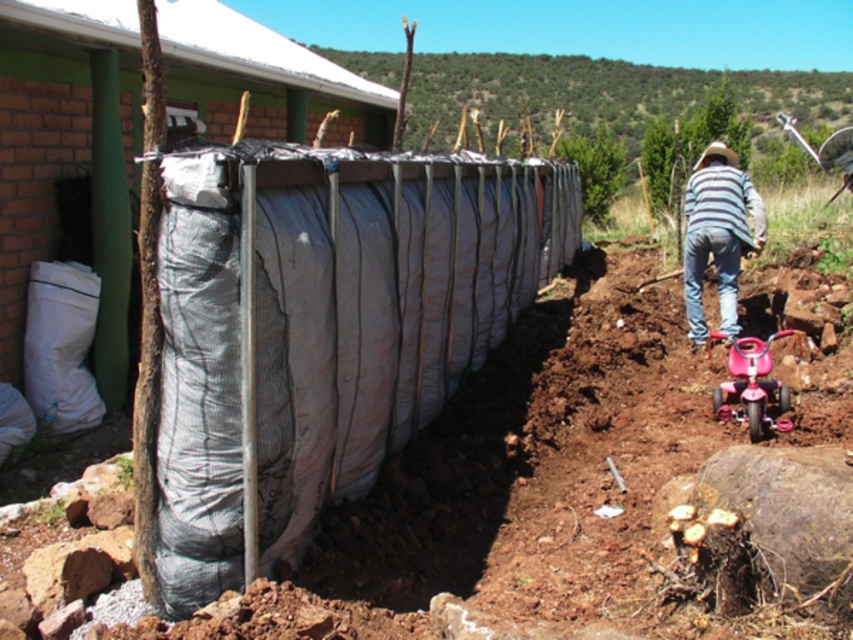
Does striped cotton shirt at right have a smaller size compared to pink plastic baby carriage at lower right?

Incorrect, striped cotton shirt at right is not smaller in size than pink plastic baby carriage at lower right.

Can you confirm if striped cotton shirt at right is positioned to the left of pink plastic baby carriage at lower right?

In fact, striped cotton shirt at right is to the right of pink plastic baby carriage at lower right.

Who is more forward, (x=704, y=218) or (x=786, y=396)?

Point (x=786, y=396) is more forward.

At what (x,y) coordinates should I click in order to perform the action: click on striped cotton shirt at right. Please return your answer as a coordinate pair (x, y). The width and height of the screenshot is (853, 640). Looking at the image, I should click on (718, 234).